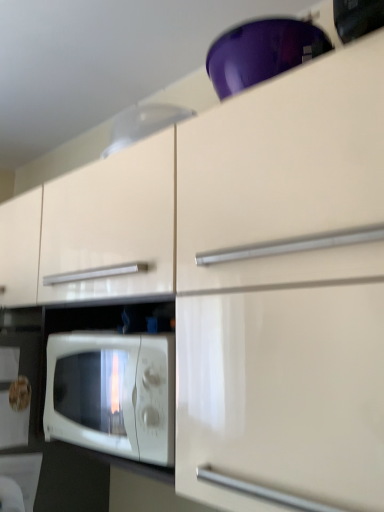
In order to face white glossy microwave oven at lower left, should I rotate leftwards or rightwards?

Rotate your view left by about 6.681°.

Describe the element at coordinates (112, 394) in the screenshot. This screenshot has height=512, width=384. I see `white glossy microwave oven at lower left` at that location.

Locate an element on the screen. This screenshot has height=512, width=384. white glossy microwave oven at lower left is located at coordinates (112, 394).

What do you see at coordinates (143, 124) in the screenshot? The height and width of the screenshot is (512, 384). I see `white glossy exhaust hood at upper center` at bounding box center [143, 124].

Where is `white glossy exhaust hood at upper center`? The width and height of the screenshot is (384, 512). white glossy exhaust hood at upper center is located at coordinates (143, 124).

You are a GUI agent. You are given a task and a screenshot of the screen. Output one action in this format:
    pyautogui.click(x=<x>, y=<y>)
    Task: Click on the white glossy microwave oven at lower left
    Image resolution: width=384 pixels, height=512 pixels.
    Given the screenshot: What is the action you would take?
    pyautogui.click(x=112, y=394)

Which object is positioned more to the left, white glossy microwave oven at lower left or white glossy exhaust hood at upper center?

white glossy microwave oven at lower left.

Who is more distant, white glossy microwave oven at lower left or white glossy exhaust hood at upper center?

white glossy exhaust hood at upper center.

Is point (107, 432) farther from viewer compared to point (109, 149)?

No, it is in front of (109, 149).

From the image's perspective, which is above, white glossy microwave oven at lower left or white glossy exhaust hood at upper center?

white glossy exhaust hood at upper center.

From a real-world perspective, is white glossy microwave oven at lower left positioned under white glossy exhaust hood at upper center based on gravity?

Yes, from a real-world perspective, white glossy microwave oven at lower left is below white glossy exhaust hood at upper center.

Which of these two, white glossy microwave oven at lower left or white glossy exhaust hood at upper center, is thinner?

white glossy exhaust hood at upper center is thinner.

Is white glossy microwave oven at lower left shorter than white glossy exhaust hood at upper center?

In fact, white glossy microwave oven at lower left may be taller than white glossy exhaust hood at upper center.

Based on the photo, considering the sizes of objects white glossy microwave oven at lower left and white glossy exhaust hood at upper center in the image provided, who is smaller, white glossy microwave oven at lower left or white glossy exhaust hood at upper center?

white glossy exhaust hood at upper center is smaller.

Is white glossy microwave oven at lower left completely or partially outside of white glossy exhaust hood at upper center?

Absolutely, white glossy microwave oven at lower left is external to white glossy exhaust hood at upper center.

Based on the photo, is white glossy microwave oven at lower left far away from white glossy exhaust hood at upper center?

Actually, white glossy microwave oven at lower left and white glossy exhaust hood at upper center are a little close together.

Could you tell me if white glossy microwave oven at lower left is facing white glossy exhaust hood at upper center?

No, white glossy microwave oven at lower left is not aimed at white glossy exhaust hood at upper center.

This screenshot has height=512, width=384. Find the location of `exhaust hood behind the white glossy microwave oven at lower left`. exhaust hood behind the white glossy microwave oven at lower left is located at coordinates (143, 124).

Considering the positions of objects white glossy exhaust hood at upper center and white glossy microwave oven at lower left in the image provided, who is more to the left, white glossy exhaust hood at upper center or white glossy microwave oven at lower left?

white glossy microwave oven at lower left is more to the left.

Who is more distant, white glossy exhaust hood at upper center or white glossy microwave oven at lower left?

white glossy exhaust hood at upper center is more distant.

Is point (132, 136) closer to camera compared to point (112, 407)?

No, it is not.

In the scene shown: From the image's perspective, does white glossy exhaust hood at upper center appear higher than white glossy microwave oven at lower left?

Yes, from the image's perspective, white glossy exhaust hood at upper center is above white glossy microwave oven at lower left.

From a real-world perspective, between white glossy exhaust hood at upper center and white glossy microwave oven at lower left, who is vertically lower?

white glossy microwave oven at lower left, from a real-world perspective.

Considering the relative sizes of white glossy exhaust hood at upper center and white glossy microwave oven at lower left in the image provided, is white glossy exhaust hood at upper center wider than white glossy microwave oven at lower left?

No.

Which of these two, white glossy exhaust hood at upper center or white glossy microwave oven at lower left, stands taller?

Standing taller between the two is white glossy microwave oven at lower left.

Is white glossy exhaust hood at upper center bigger than white glossy microwave oven at lower left?

No.

From the picture: Is white glossy exhaust hood at upper center not inside white glossy microwave oven at lower left?

Indeed, white glossy exhaust hood at upper center is completely outside white glossy microwave oven at lower left.

Are white glossy exhaust hood at upper center and white glossy microwave oven at lower left making contact?

No, white glossy exhaust hood at upper center is not beside white glossy microwave oven at lower left.

Is white glossy exhaust hood at upper center oriented towards white glossy microwave oven at lower left?

No, white glossy exhaust hood at upper center is not turned towards white glossy microwave oven at lower left.

From the picture: How distant is white glossy exhaust hood at upper center from white glossy microwave oven at lower left?

white glossy exhaust hood at upper center is 25.17 inches away from white glossy microwave oven at lower left.

The height and width of the screenshot is (512, 384). In order to click on exhaust hood above the white glossy microwave oven at lower left (from the image's perspective) in this screenshot , I will do `click(143, 124)`.

This screenshot has width=384, height=512. I want to click on microwave oven below the white glossy exhaust hood at upper center (from the image's perspective), so click(112, 394).

Locate an element on the screen. The height and width of the screenshot is (512, 384). exhaust hood that appears on the right of white glossy microwave oven at lower left is located at coordinates (143, 124).